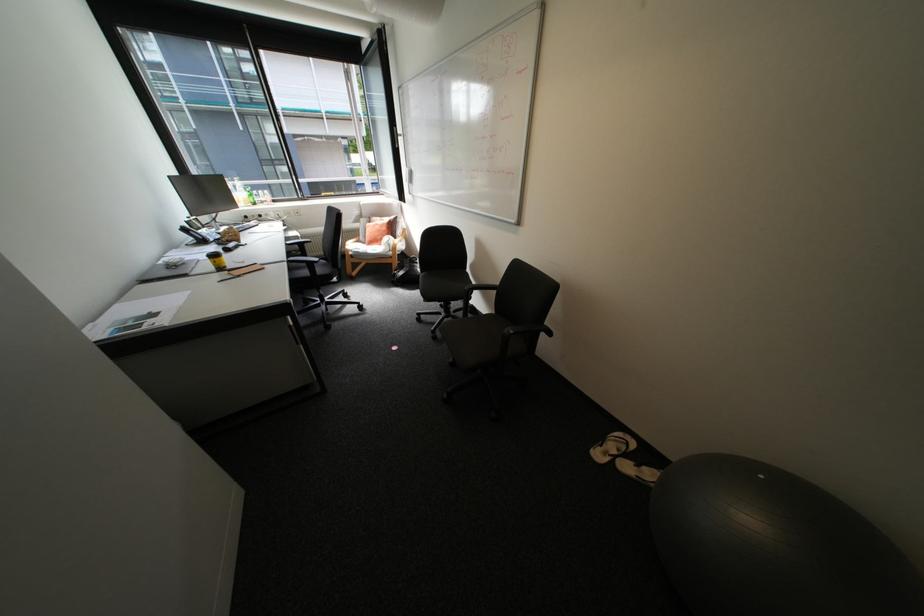
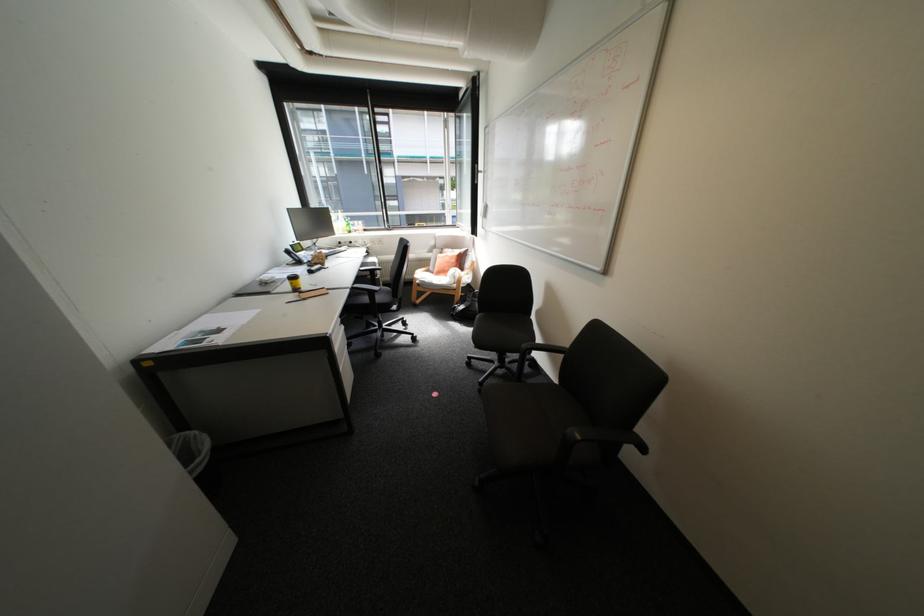
The point at (444, 331) is marked in the first image. Where is the corresponding point in the second image?

(491, 384)